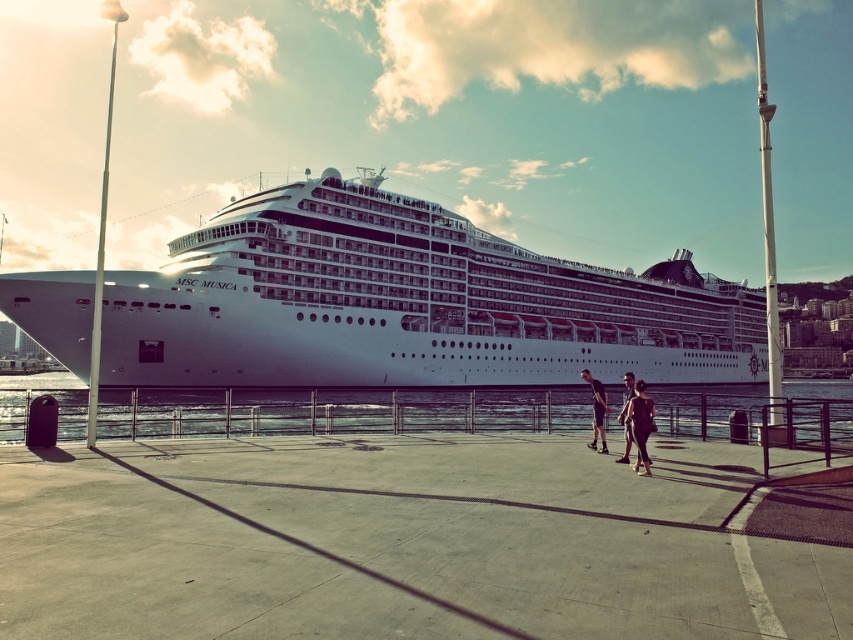
You are a photographer trying to capture the MSC Musica cruise ship. You notice two people wearing matte black clothing at center and dark gray fabric pants at center walking towards the ship. Based on their positions, which clothing item is closer to the camera?

The matte black clothing at center is positioned under the dark gray fabric pants at center, meaning the dark gray fabric pants at center are closer to the camera since they are above in the image.

You are observing three people walking towards the MSC Musica cruise ship. Among them, you notice two individuals wearing dark gray fabric pants at center and matte black shorts at center. Which one is located to the left of the other?

The dark gray fabric pants at center is positioned on the left side of matte black shorts at center.

You are standing on the pier and see two points marked on the image. The first point is at coordinates point (602, 388) and the second point is at point (627, 426). Which point is closer to you?

Point (602, 388) is closer to you because it is further to the viewer than point (627, 426).